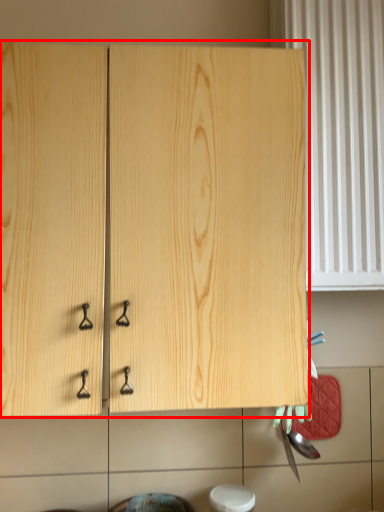
Question: From the image's perspective, what is the correct spatial positioning of cabinetry (annotated by the red box) in reference to curtain?

Choices:
 (A) above
 (B) below

Answer: (B)